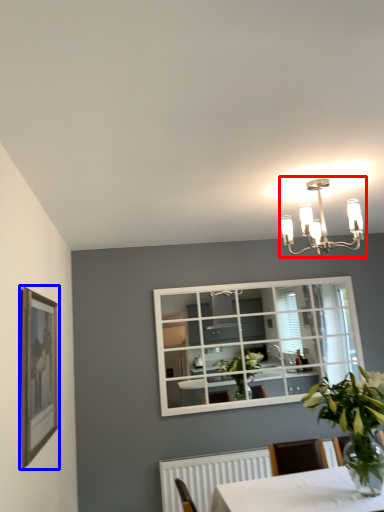
Question: Which object appears closest to the camera in this image, lamp (highlighted by a red box) or picture frame (highlighted by a blue box)?

Choices:
 (A) lamp
 (B) picture frame

Answer: (B)